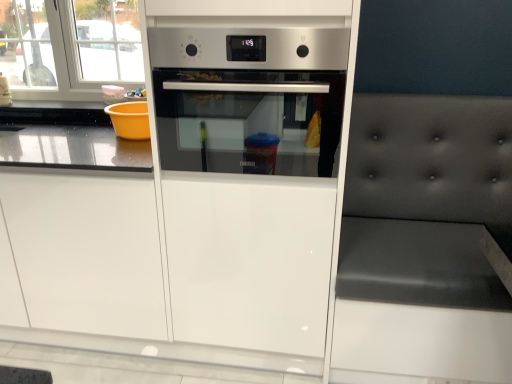
What do you see at coordinates (248, 97) in the screenshot?
I see `satin silver oven at center` at bounding box center [248, 97].

This screenshot has width=512, height=384. What do you see at coordinates (424, 237) in the screenshot?
I see `dark gray tufted cushion at right` at bounding box center [424, 237].

Identify the location of satin silver oven at center. (247, 174).

Is point (64, 188) positioned in front of point (317, 283)?

Yes, point (64, 188) is closer to viewer.

Is white glossy drawer at center at the left side of satin silver oven at center?

→ Yes, white glossy drawer at center is to the left of satin silver oven at center.

Which of these two, white glossy drawer at center or satin silver oven at center, is wider?

satin silver oven at center is wider.

Which is more distant, (385, 362) or (251, 82)?

Positioned behind is point (385, 362).

Is dark gray tufted cushion at right far away from satin silver oven at center?

They are positioned close to each other.

From a real-world perspective, who is located higher, dark gray tufted cushion at right or satin silver oven at center?

satin silver oven at center is physically above.

In the image, is dark gray tufted cushion at right on the left side or the right side of satin silver oven at center?

dark gray tufted cushion at right is positioned on satin silver oven at center's right side.

Is satin silver oven at center a part of white glossy drawer at center?

Actually, satin silver oven at center is outside white glossy drawer at center.

Considering the relative sizes of white glossy drawer at center and satin silver oven at center in the image provided, is white glossy drawer at center bigger than satin silver oven at center?

Yes, white glossy drawer at center is bigger than satin silver oven at center.

Is white glossy drawer at center to the left of satin silver oven at center from the viewer's perspective?

Yes, white glossy drawer at center is to the left of satin silver oven at center.

You are a GUI agent. You are given a task and a screenshot of the screen. Output one action in this format:
    pyautogui.click(x=<x>, y=<y>)
    Task: Click on the drawer to the left of satin silver oven at center
    
    Given the screenshot: What is the action you would take?
    pyautogui.click(x=87, y=252)

In order to click on chair above the white glossy drawer at center (from a real-world perspective) in this screenshot , I will do `click(424, 237)`.

Between dark gray tufted cushion at right and white glossy drawer at center, which one has smaller width?

Thinner between the two is white glossy drawer at center.

Are dark gray tufted cushion at right and white glossy drawer at center far apart?

dark gray tufted cushion at right is near white glossy drawer at center, not far away.

What's the angular difference between dark gray tufted cushion at right and white glossy drawer at center's facing directions?

The facing directions of dark gray tufted cushion at right and white glossy drawer at center are 1.7 degrees apart.

Which is in front, point (231, 87) or point (490, 115)?

Positioned in front is point (231, 87).

Consider the image. How much distance is there between satin silver oven at center and dark gray tufted cushion at right?

The distance of satin silver oven at center from dark gray tufted cushion at right is 18.06 inches.

Considering the relative sizes of satin silver oven at center and dark gray tufted cushion at right in the image provided, is satin silver oven at center shorter than dark gray tufted cushion at right?

Incorrect, the height of satin silver oven at center does not fall short of that of dark gray tufted cushion at right.

Could you tell me if satin silver oven at center is facing dark gray tufted cushion at right?

No, satin silver oven at center does not turn towards dark gray tufted cushion at right.

This screenshot has width=512, height=384. What are the coordinates of `fridge lying in front of the satin silver oven at center` in the screenshot? It's located at (247, 174).

Is satin silver oven at center far from satin silver oven at center?

satin silver oven at center is actually quite close to satin silver oven at center.

Between satin silver oven at center and satin silver oven at center, which one appears on the left side from the viewer's perspective?

From the viewer's perspective, satin silver oven at center appears more on the left side.

Is satin silver oven at center not close to white glossy drawer at center?

That's not correct — satin silver oven at center is a little close to white glossy drawer at center.

From the image's perspective, who appears lower, satin silver oven at center or white glossy drawer at center?

white glossy drawer at center, from the image's perspective.

Considering the points (182, 22) and (18, 240), which point is in front, point (182, 22) or point (18, 240)?

Point (182, 22)

I want to click on fridge on the right of white glossy drawer at center, so click(x=247, y=174).

The height and width of the screenshot is (384, 512). Identify the location of home appliance that is above the dark gray tufted cushion at right (from the image's perspective). (248, 97).

When comparing their distances from satin silver oven at center, does white glossy drawer at center or dark gray tufted cushion at right seem further?

Based on the image, dark gray tufted cushion at right appears to be further to satin silver oven at center.

Based on their spatial positions, is dark gray tufted cushion at right or white glossy drawer at center further from satin silver oven at center?

dark gray tufted cushion at right.

Based on the photo, looking at the image, which one is located further to satin silver oven at center, satin silver oven at center or white glossy drawer at center?

white glossy drawer at center.

Looking at the image, which one is located closer to dark gray tufted cushion at right, white glossy drawer at center or satin silver oven at center?

satin silver oven at center lies closer to dark gray tufted cushion at right than the other object.

Considering their positions, is white glossy drawer at center positioned further to satin silver oven at center than satin silver oven at center?

The object further to satin silver oven at center is white glossy drawer at center.

When comparing their distances from satin silver oven at center, does dark gray tufted cushion at right or white glossy drawer at center seem further?

Among the two, dark gray tufted cushion at right is located further to satin silver oven at center.

Looking at the image, which one is located further to satin silver oven at center, white glossy drawer at center or dark gray tufted cushion at right?

dark gray tufted cushion at right lies further to satin silver oven at center than the other object.

Which object lies further to the anchor point white glossy drawer at center, satin silver oven at center or dark gray tufted cushion at right?

Among the two, dark gray tufted cushion at right is located further to white glossy drawer at center.

Identify the location of fridge situated between white glossy drawer at center and dark gray tufted cushion at right from left to right. This screenshot has width=512, height=384. (247, 174).

Where is `fridge between satin silver oven at center and dark gray tufted cushion at right`? The height and width of the screenshot is (384, 512). fridge between satin silver oven at center and dark gray tufted cushion at right is located at coordinates (247, 174).

What are the coordinates of `home appliance situated between white glossy drawer at center and dark gray tufted cushion at right from left to right` in the screenshot? It's located at (248, 97).

The image size is (512, 384). I want to click on home appliance between white glossy drawer at center and satin silver oven at center in the horizontal direction, so click(248, 97).